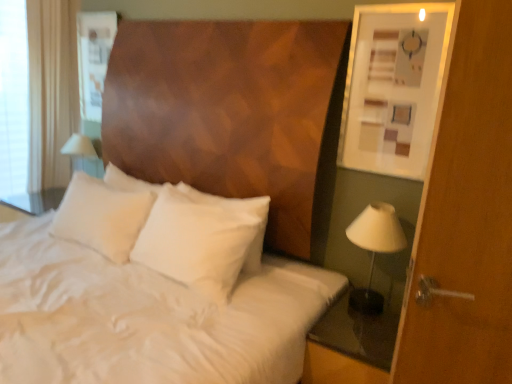
Question: Does white fabric at left have a greater height compared to white fabric lampshade at right?

Choices:
 (A) no
 (B) yes

Answer: (B)

Question: Does white fabric at left have a smaller size compared to white fabric lampshade at right?

Choices:
 (A) no
 (B) yes

Answer: (A)

Question: From a real-world perspective, is white fabric at left positioned under white fabric lampshade at right based on gravity?

Choices:
 (A) yes
 (B) no

Answer: (B)

Question: Does white fabric at left have a lesser height compared to white fabric lampshade at right?

Choices:
 (A) no
 (B) yes

Answer: (A)

Question: From a real-world perspective, is white fabric at left on white fabric lampshade at right?

Choices:
 (A) yes
 (B) no

Answer: (A)

Question: From the image's perspective, is white fabric at left positioned above or below transparent glass nightstand at lower right?

Choices:
 (A) below
 (B) above

Answer: (B)

Question: Is white fabric at left to the left or to the right of transparent glass nightstand at lower right in the image?

Choices:
 (A) left
 (B) right

Answer: (A)

Question: Considering their positions, is white fabric at left located in front of or behind transparent glass nightstand at lower right?

Choices:
 (A) behind
 (B) front

Answer: (A)

Question: Is point (8, 125) positioned closer to the camera than point (353, 339)?

Choices:
 (A) closer
 (B) farther

Answer: (B)

Question: Which is correct: white soft pillow at center is inside white fabric lampshade at right, or outside of it?

Choices:
 (A) inside
 (B) outside

Answer: (B)

Question: Relative to white fabric lampshade at right, is white soft pillow at center in front or behind?

Choices:
 (A) behind
 (B) front

Answer: (A)

Question: From the image's perspective, is white soft pillow at center located above or below white fabric lampshade at right?

Choices:
 (A) below
 (B) above

Answer: (B)

Question: Does point (252, 258) appear closer or farther from the camera than point (358, 220)?

Choices:
 (A) farther
 (B) closer

Answer: (A)

Question: Is white satin bedsheet at center to the left or to the right of matte white picture frame at upper right in the image?

Choices:
 (A) left
 (B) right

Answer: (A)

Question: Looking at their shapes, would you say white satin bedsheet at center is wider or thinner than matte white picture frame at upper right?

Choices:
 (A) wide
 (B) thin

Answer: (A)